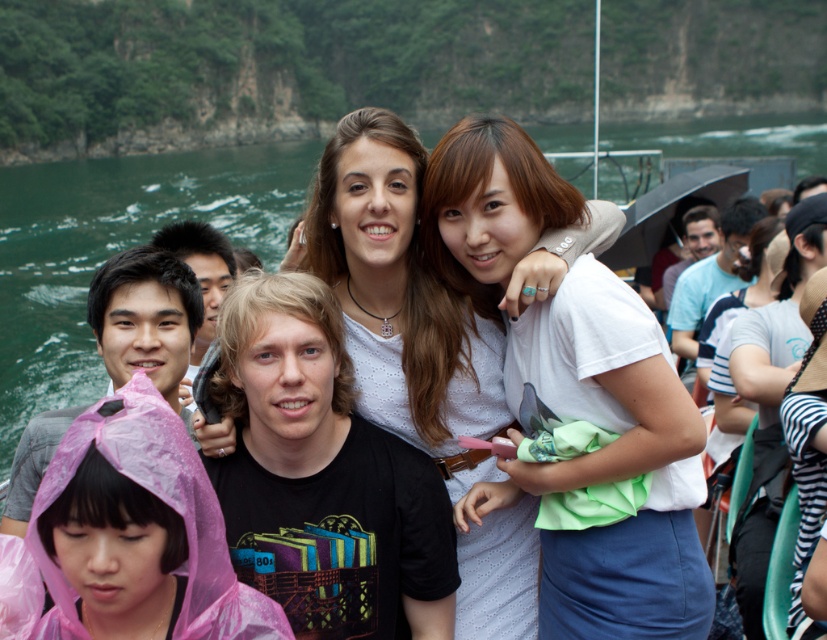
You are standing at point (177, 266) and want to walk towards point (275, 416). Is the path between these two points clear of any obstacles?

Yes, the path between point (275, 416) and point (177, 266) is clear since point (275, 416) is in front of point (177, 266), indicating no obstruction between them.

You are standing on the boat and want to grab the pink plastic raincoat at lower left. Considering the distance, can you reach it without moving your feet?

The pink plastic raincoat at lower left is 103.53 feet away from the viewer, which is too far to reach without moving your feet.